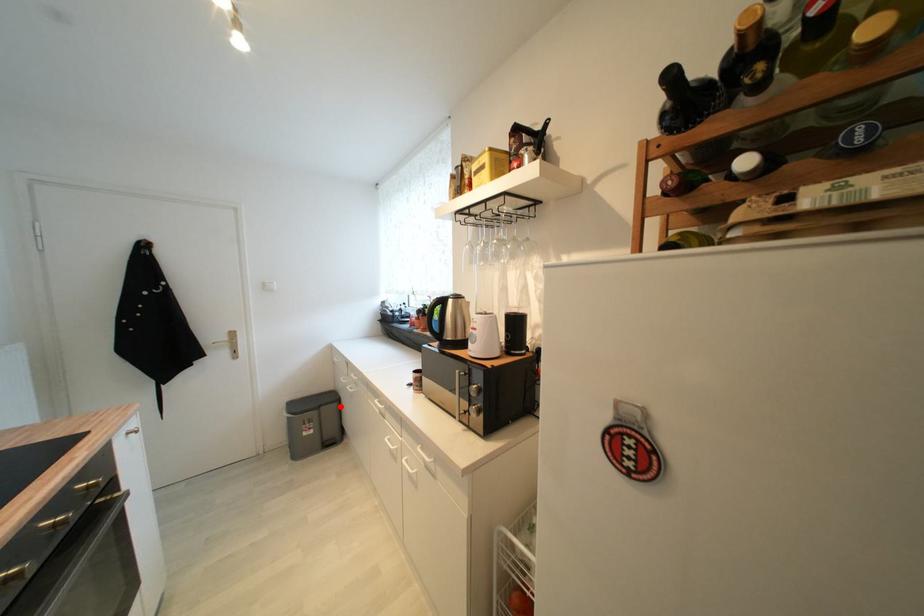
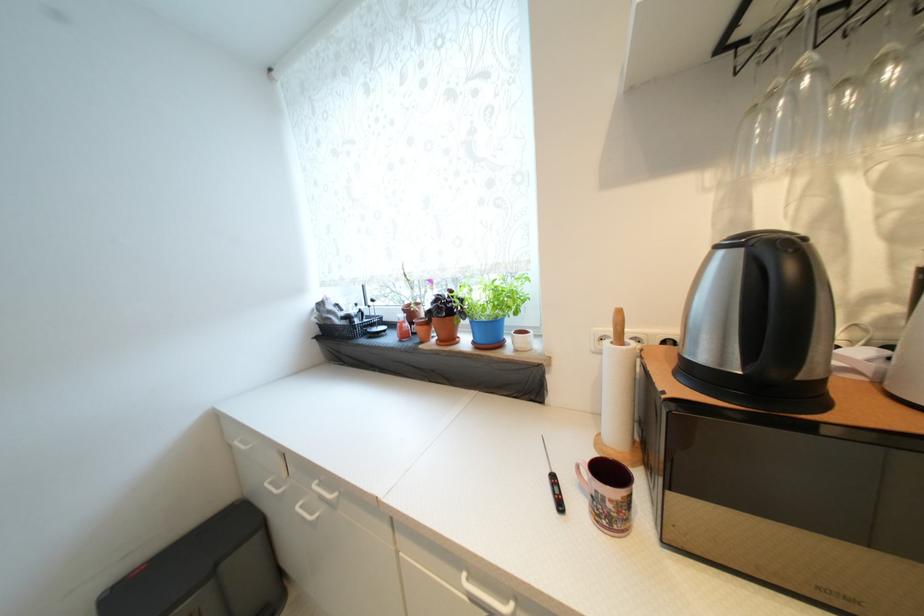
Question: I am providing you with two images of the same scene from different viewpoints. Image1 has a red point marked. In image2, the corresponding 3D location appears at what relative position? Reply with the corresponding letter.

Choices:
 (A) Closer
 (B) Farther

Answer: (A)